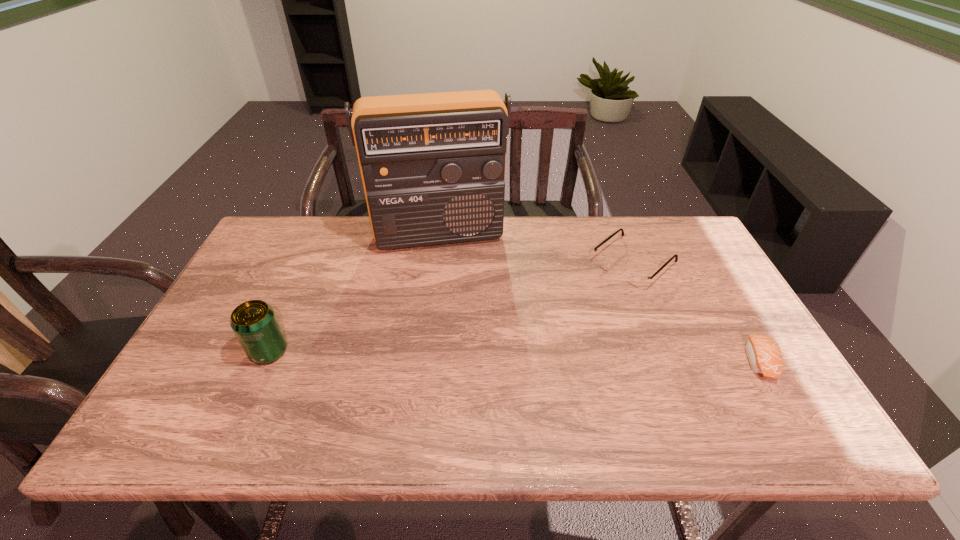
The height and width of the screenshot is (540, 960). I want to click on vacant space in between the tallest object and the sushi, so click(599, 298).

Where is `vacant space that is in between the shortest object and the third tallest object`? This screenshot has width=960, height=540. vacant space that is in between the shortest object and the third tallest object is located at coordinates (696, 313).

Locate an element on the screen. This screenshot has width=960, height=540. empty space between the leftmost object and the rightmost object is located at coordinates (514, 356).

The image size is (960, 540). I want to click on empty space between the rightmost object and the leftmost object, so click(x=514, y=356).

You are a GUI agent. You are given a task and a screenshot of the screen. Output one action in this format:
    pyautogui.click(x=<x>, y=<y>)
    Task: Click on the unoccupied area between the rightmost object and the tallest object
    
    Given the screenshot: What is the action you would take?
    pyautogui.click(x=599, y=298)

Locate an element on the screen. The image size is (960, 540). unoccupied position between the radio receiver and the beer can is located at coordinates (354, 293).

What are the coordinates of `free space that is in between the leftmost object and the tallest object` in the screenshot? It's located at (354, 293).

Locate an element on the screen. vacant space in between the rightmost object and the third shortest object is located at coordinates (514, 356).

Where is `vacant area that lies between the beer can and the shortest object`? The image size is (960, 540). vacant area that lies between the beer can and the shortest object is located at coordinates (514, 356).

The height and width of the screenshot is (540, 960). What are the coordinates of `object that is the second closest to the third object from right to left` in the screenshot? It's located at (254, 322).